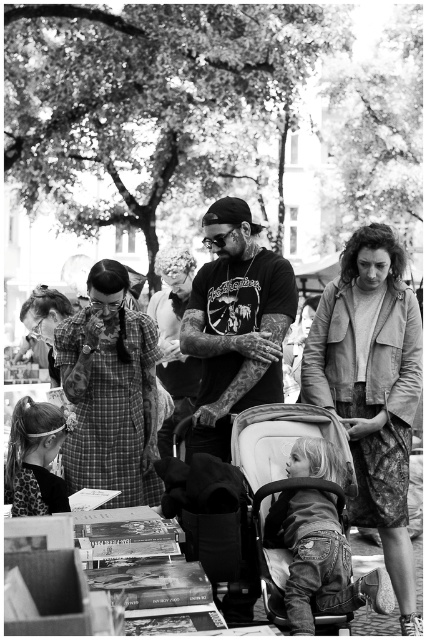
In the scene shown: Between leather jacket at center and white fabric baby carriage at lower center, which one appears on the right side from the viewer's perspective?

From the viewer's perspective, leather jacket at center appears more on the right side.

Is point (310, 378) less distant than point (266, 515)?

No, it is behind (266, 515).

Is point (348, 276) closer to viewer compared to point (332, 413)?

That is False.

Find the location of `leather jacket at center`. leather jacket at center is located at coordinates (373, 388).

Based on the photo, is plaid fabric dress at center shorter than tattooed skin at center?

No.

Does point (114, 500) come in front of point (251, 314)?

Yes, it is in front of point (251, 314).

Where is `plaid fabric dress at center`? This screenshot has height=640, width=427. plaid fabric dress at center is located at coordinates (111, 392).

This screenshot has height=640, width=427. I want to click on leather jacket at center, so click(x=373, y=388).

I want to click on leather jacket at center, so click(373, 388).